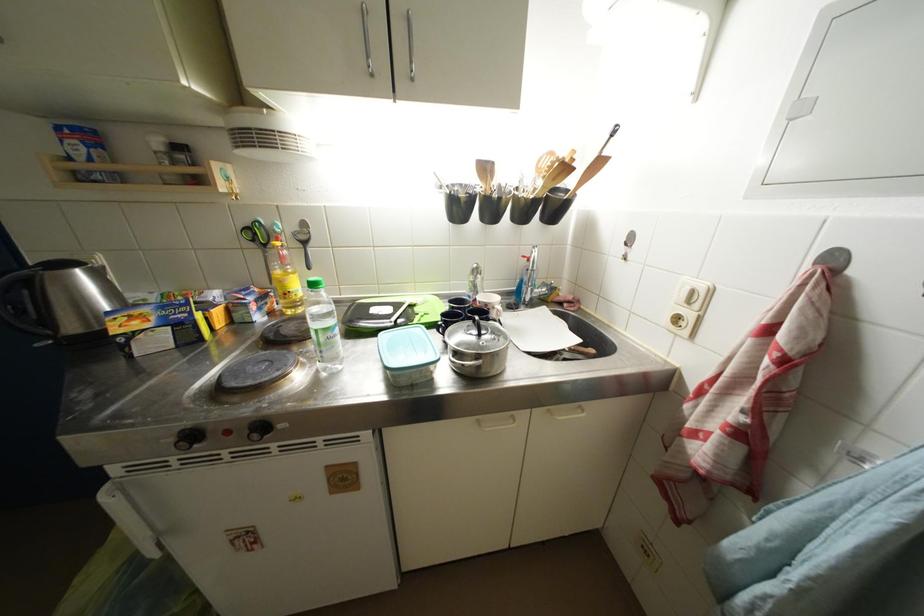
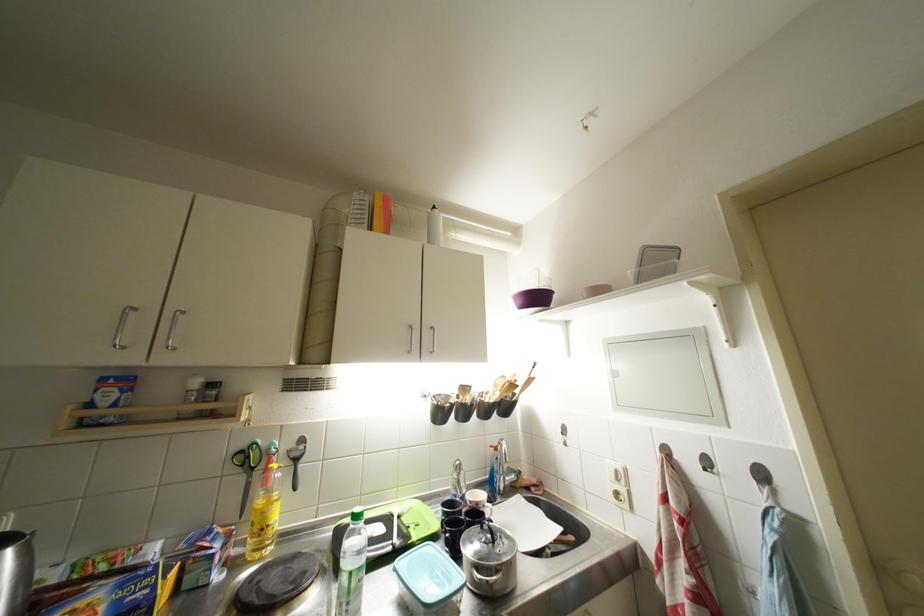
Locate, in the second image, the point that corresponds to (x=492, y=309) in the first image.

(483, 508)